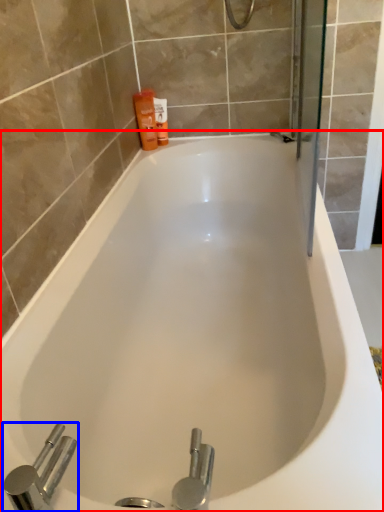
Question: Which of the following is the farthest to the observer, bathtub (highlighted by a red box) or tap (highlighted by a blue box)?

Choices:
 (A) bathtub
 (B) tap

Answer: (A)